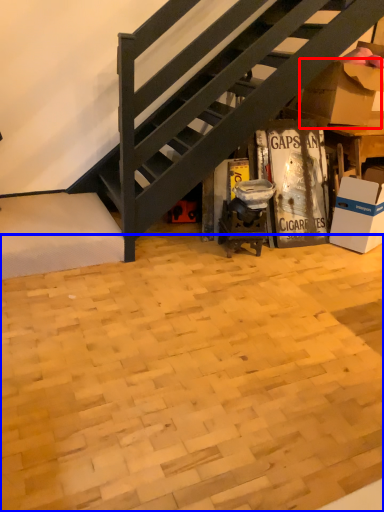
Question: Which of the following is the farthest to the observer, cardboard box (highlighted by a red box) or plywood (highlighted by a blue box)?

Choices:
 (A) cardboard box
 (B) plywood

Answer: (A)